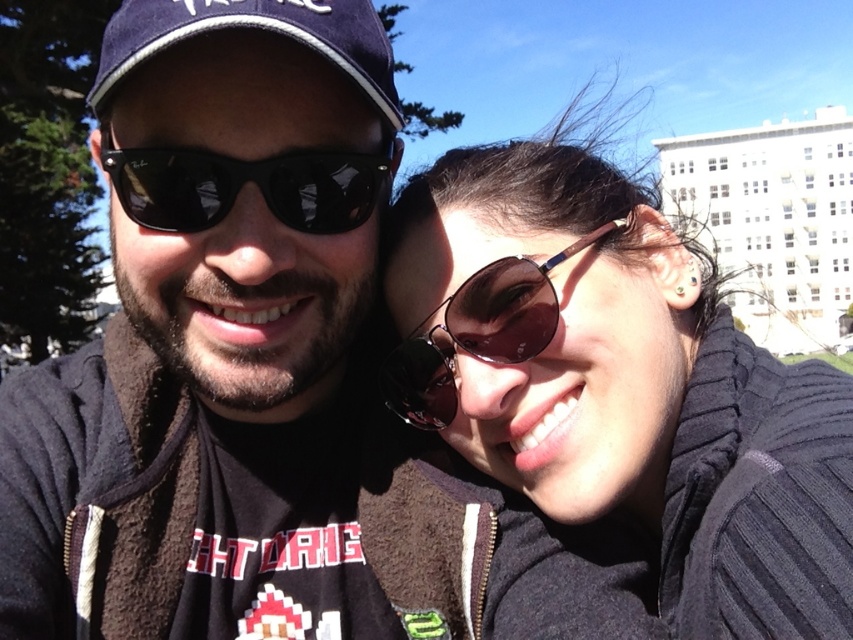
Who is shorter, black ray-ban sunglasses at center or shiny dark sunglasses at center?

With less height is black ray-ban sunglasses at center.

Describe the element at coordinates (242, 182) in the screenshot. This screenshot has height=640, width=853. I see `black ray-ban sunglasses at center` at that location.

The image size is (853, 640). I want to click on black ray-ban sunglasses at center, so click(242, 182).

Based on the photo, can you confirm if matte black sunglasses at center is positioned to the left of shiny dark sunglasses at center?

Yes, matte black sunglasses at center is to the left of shiny dark sunglasses at center.

Is matte black sunglasses at center closer to camera compared to shiny dark sunglasses at center?

Yes, matte black sunglasses at center is in front of shiny dark sunglasses at center.

Is point (331, 512) farther from camera compared to point (619, 220)?

Yes, point (331, 512) is farther from viewer.

Where is `matte black sunglasses at center`? matte black sunglasses at center is located at coordinates (215, 333).

Is black ray-ban sunglasses at center to the right of navy blue fabric baseball cap at upper left from the viewer's perspective?

Indeed, black ray-ban sunglasses at center is positioned on the right side of navy blue fabric baseball cap at upper left.

What do you see at coordinates (242, 182) in the screenshot? I see `black ray-ban sunglasses at center` at bounding box center [242, 182].

Is point (158, 195) less distant than point (199, 32)?

No, it is behind (199, 32).

The image size is (853, 640). I want to click on black ray-ban sunglasses at center, so click(x=242, y=182).